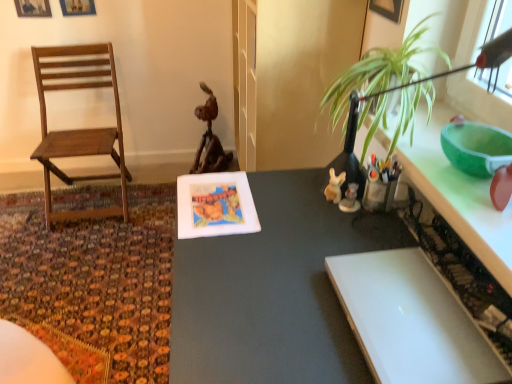
Locate an element on the screen. blank space situated above matte gray table at center (from a real-world perspective) is located at coordinates (278, 274).